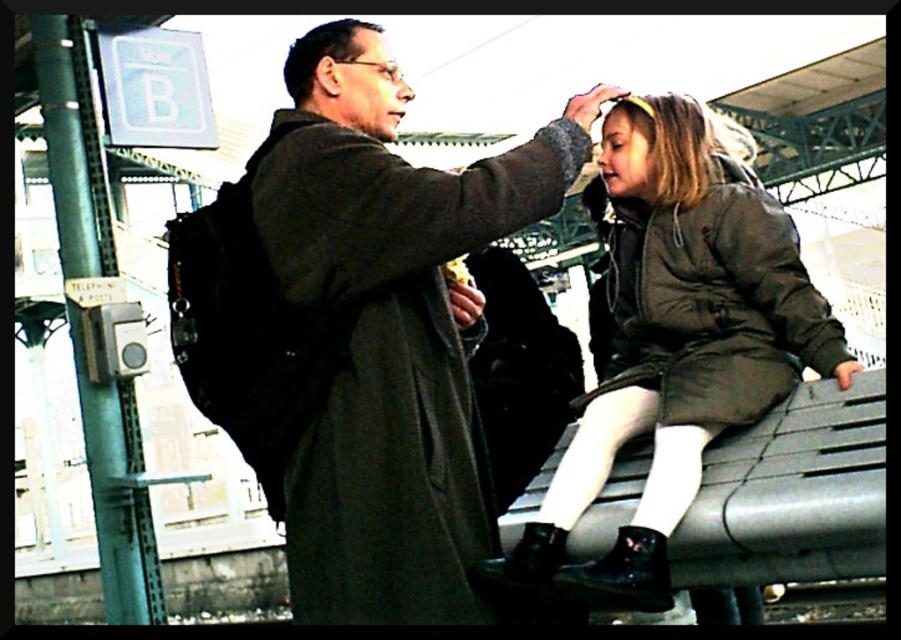
Question: Estimate the real-world distances between objects in this image. Which object is farther from the dark gray coat at center?

Choices:
 (A) matte black forehead at upper center
 (B) dark green matte coat at center
 (C) dark green jacket at center
 (D) matte black coat at center

Answer: (B)

Question: From the image, what is the correct spatial relationship of dark gray coat at center in relation to dark green matte coat at center?

Choices:
 (A) below
 (B) above

Answer: (A)

Question: Does dark gray coat at center come behind matte black forehead at upper center?

Choices:
 (A) no
 (B) yes

Answer: (A)

Question: Among these points, which one is nearest to the camera?

Choices:
 (A) (613, 572)
 (B) (359, 36)
 (C) (506, 426)
 (D) (535, 188)

Answer: (A)

Question: Which of the following is the farthest from the observer?

Choices:
 (A) (716, 420)
 (B) (653, 364)
 (C) (495, 449)
 (D) (358, 54)

Answer: (C)

Question: Is matte black coat at center positioned before matte black forehead at upper center?

Choices:
 (A) no
 (B) yes

Answer: (B)